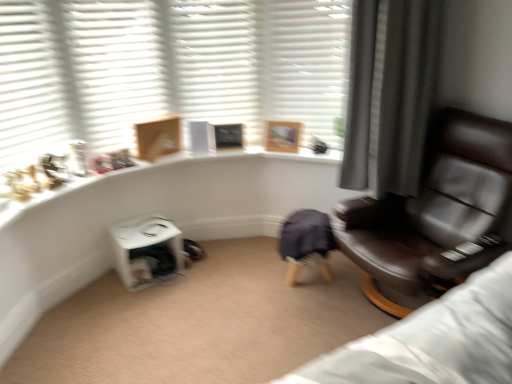
Question: Do you think white matte shutter at upper center, the second shutter from the right, is within white plastic table at lower center, or outside of it?

Choices:
 (A) outside
 (B) inside

Answer: (A)

Question: Is point (186, 74) positioned closer to the camera than point (155, 223)?

Choices:
 (A) closer
 (B) farther

Answer: (A)

Question: Based on their relative distances, which object is nearer to the white matte shutter at upper center, which appears as the 4th shutter when viewed from the left?

Choices:
 (A) wooden picture frame at upper center
 (B) white plastic table at lower center
 (C) white matte shutter at upper left, marked as the third shutter in a right-to-left arrangement
 (D) white matte shutters at upper left, the fourth shutter from the right
 (E) white matte shutter at upper center, the second shutter from the right

Answer: (E)

Question: Which is nearer to the wooden picture frame at upper center?

Choices:
 (A) white matte shutters at upper left, the fourth shutter from the right
 (B) white matte shutter at upper center, marked as the third shutter in a left-to-right arrangement
 (C) white plastic table at lower center
 (D) brown leather chair at right
 (E) white matte shutter at upper left, marked as the third shutter in a right-to-left arrangement

Answer: (B)